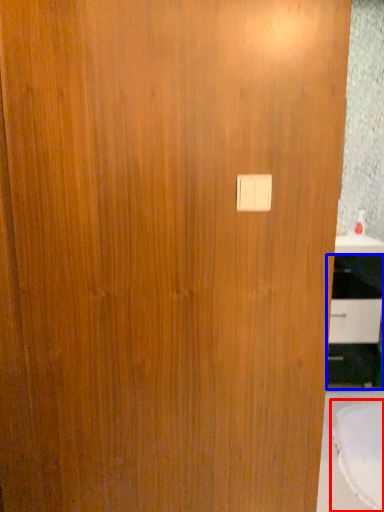
Question: Among these objects, which one is nearest to the camera, round table (highlighted by a red box) or cabinetry (highlighted by a blue box)?

Choices:
 (A) round table
 (B) cabinetry

Answer: (A)